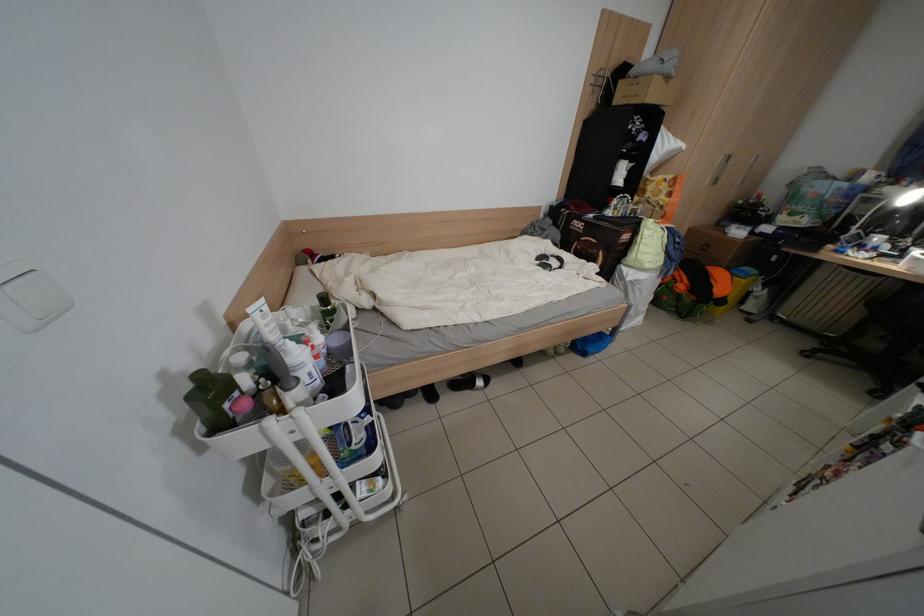
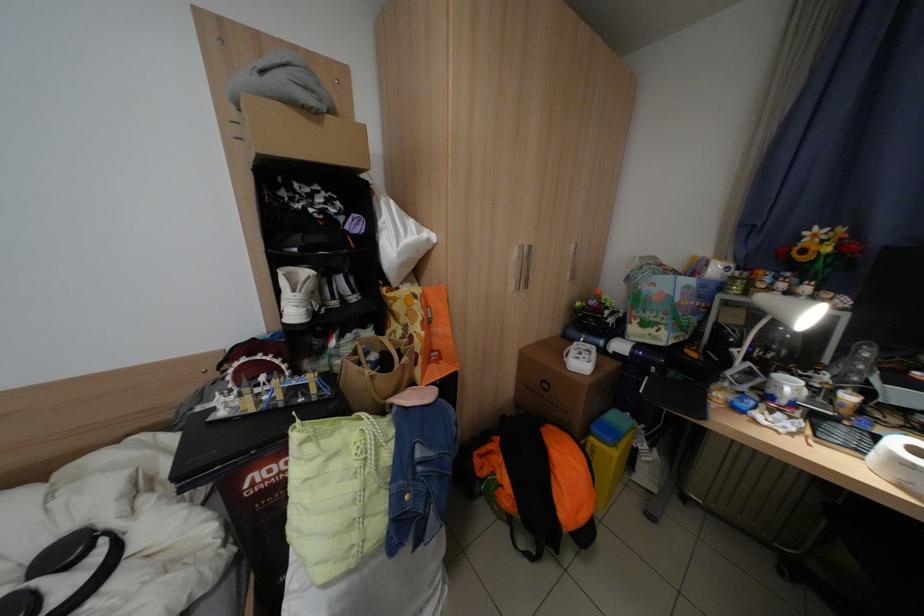
The point at [723,288] is marked in the first image. Where is the corresponding point in the second image?

(565, 508)